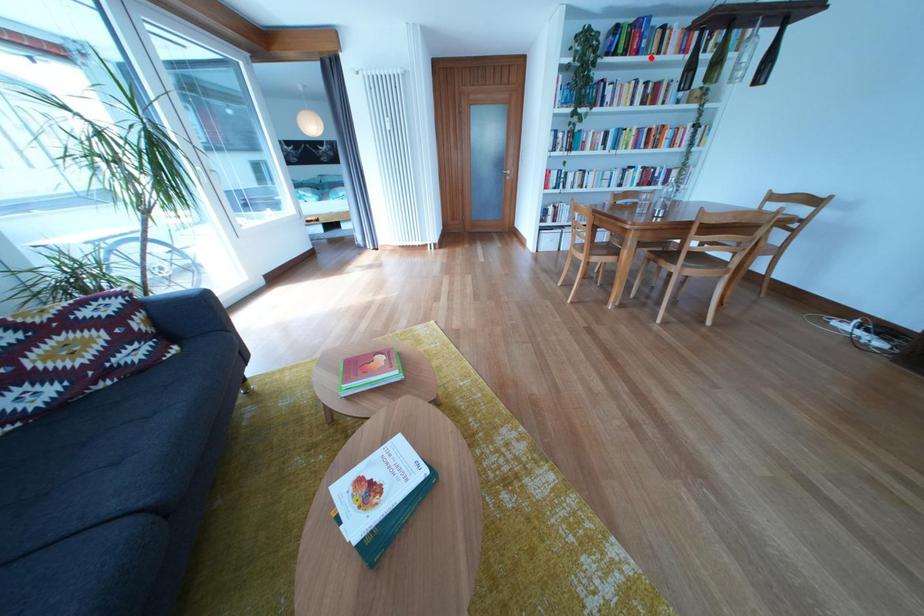
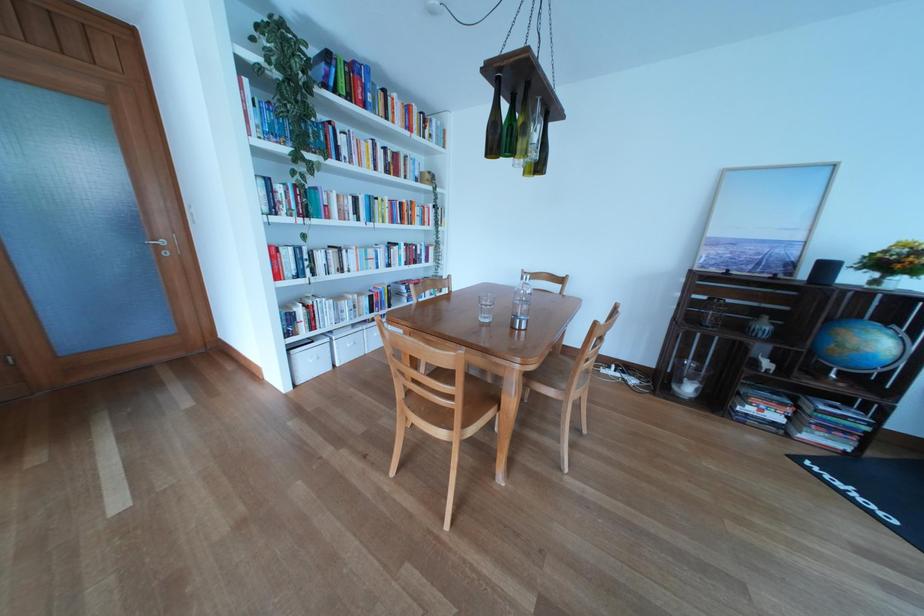
Locate, in the second image, the point that corresponds to the highlighted location in the first image.

(378, 111)